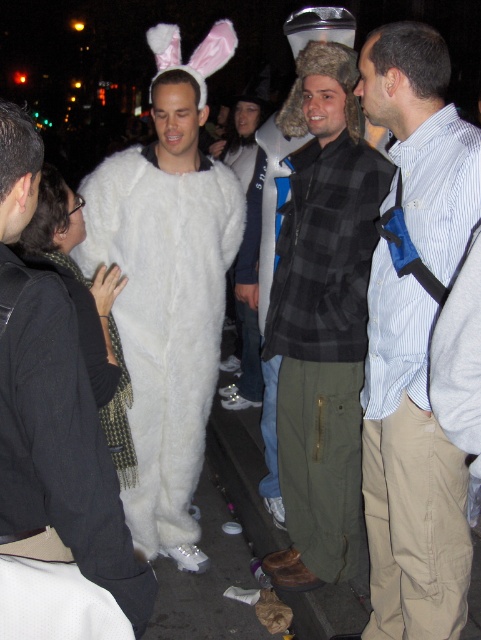
Question: Which object is positioned closest to the striped cotton shirt at center?

Choices:
 (A) white furry costume at center
 (B) white furry costume at left
 (C) black flannel shirt at center

Answer: (C)

Question: From the image, what is the correct spatial relationship of striped cotton shirt at center in relation to white furry costume at center?

Choices:
 (A) left
 (B) right

Answer: (B)

Question: Is black flannel shirt at center above white furry costume at center?

Choices:
 (A) yes
 (B) no

Answer: (A)

Question: Which object is closer to the camera taking this photo?

Choices:
 (A) striped cotton shirt at center
 (B) black flannel shirt at center
 (C) white furry costume at left
 (D) white furry costume at center

Answer: (D)

Question: Which of the following is the closest to the observer?

Choices:
 (A) black flannel shirt at center
 (B) striped cotton shirt at center

Answer: (B)

Question: Is striped cotton shirt at center closer to camera compared to white furry costume at center?

Choices:
 (A) no
 (B) yes

Answer: (A)